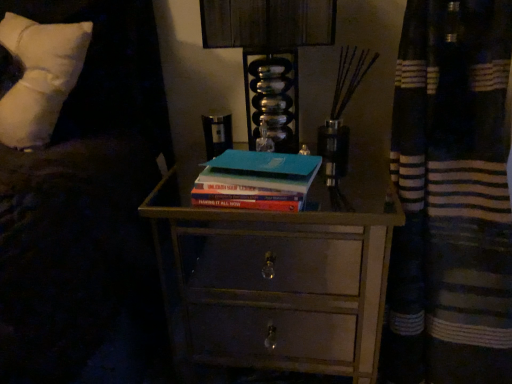
Question: Would you say wooden chest of drawers at center is part of white soft pillow at upper left's contents?

Choices:
 (A) no
 (B) yes

Answer: (A)

Question: Is white soft pillow at upper left at the right side of wooden chest of drawers at center?

Choices:
 (A) no
 (B) yes

Answer: (A)

Question: Considering the relative sizes of white soft pillow at upper left and wooden chest of drawers at center in the image provided, is white soft pillow at upper left smaller than wooden chest of drawers at center?

Choices:
 (A) no
 (B) yes

Answer: (B)

Question: Is white soft pillow at upper left outside wooden chest of drawers at center?

Choices:
 (A) no
 (B) yes

Answer: (B)

Question: Considering the relative sizes of white soft pillow at upper left and wooden chest of drawers at center in the image provided, is white soft pillow at upper left wider than wooden chest of drawers at center?

Choices:
 (A) yes
 (B) no

Answer: (B)

Question: Visually, is metallic glass at upper center positioned to the left or to the right of white soft pillow at upper left?

Choices:
 (A) left
 (B) right

Answer: (B)

Question: Do you think metallic glass at upper center is within white soft pillow at upper left, or outside of it?

Choices:
 (A) outside
 (B) inside

Answer: (A)

Question: From their relative heights in the image, would you say metallic glass at upper center is taller or shorter than white soft pillow at upper left?

Choices:
 (A) tall
 (B) short

Answer: (A)

Question: In terms of size, does metallic glass at upper center appear bigger or smaller than white soft pillow at upper left?

Choices:
 (A) small
 (B) big

Answer: (B)

Question: In terms of width, does white soft pillow at upper left look wider or thinner when compared to metallic glass at upper center?

Choices:
 (A) thin
 (B) wide

Answer: (B)

Question: From the image's perspective, is white soft pillow at upper left above or below metallic glass at upper center?

Choices:
 (A) above
 (B) below

Answer: (B)

Question: Considering the relative positions of white soft pillow at upper left and metallic glass at upper center in the image provided, is white soft pillow at upper left to the left or to the right of metallic glass at upper center?

Choices:
 (A) left
 (B) right

Answer: (A)

Question: Considering the positions of white soft pillow at upper left and metallic glass at upper center in the image, is white soft pillow at upper left bigger or smaller than metallic glass at upper center?

Choices:
 (A) big
 (B) small

Answer: (B)

Question: In terms of height, does white soft pillow at upper left look taller or shorter compared to teal matte book at center?

Choices:
 (A) tall
 (B) short

Answer: (A)

Question: Considering the positions of white soft pillow at upper left and teal matte book at center in the image, is white soft pillow at upper left wider or thinner than teal matte book at center?

Choices:
 (A) thin
 (B) wide

Answer: (B)